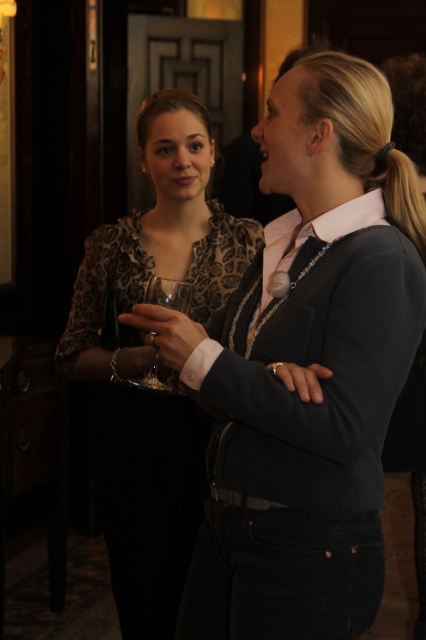
You are a photographer at a social event. You want to take a photo of the dark blue corduroy blazer at center and the camera. Are they close enough to be in the same frame without moving either object? The camera has a standard lens with a focal length of 50mm.

The dark blue corduroy blazer at center and camera are 4.48 feet apart from each other. With a standard 50mm lens, this distance can be captured in a single frame without needing to move either object, as 4.48 feet is within the typical framing range for such a lens.

Looking at this image, you are standing in the room and want to hand a document to the person wearing the dark blue corduroy blazer at center. Which direction should you move to reach them?

The dark blue corduroy blazer at center is located at point 0.670 in the x coordinate and 0.709 in the y coordinate, so you should move towards the center of the room to reach them.